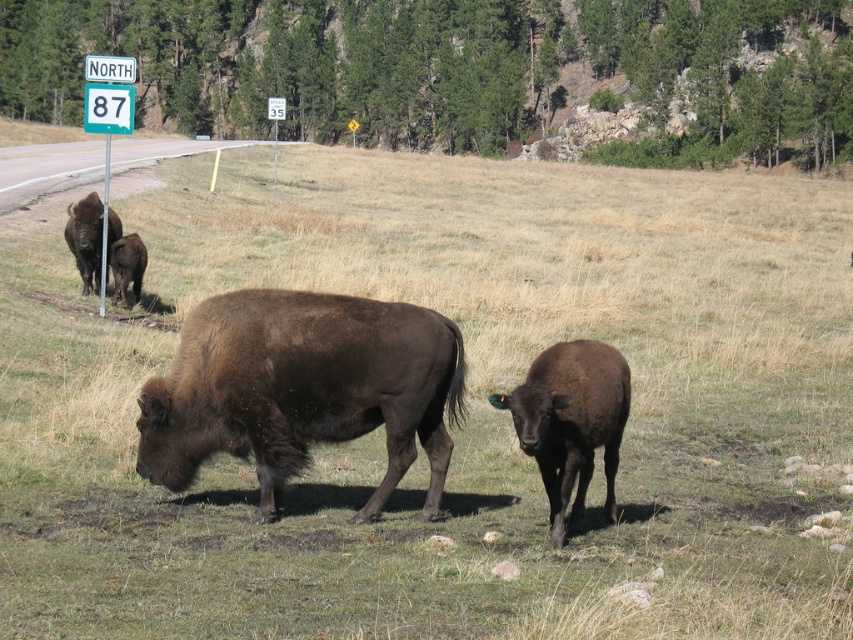
Question: Which point is farther to the camera?

Choices:
 (A) coord(30,172)
 (B) coord(132,266)
 (C) coord(106,198)
 (D) coord(622,141)

Answer: (D)

Question: Observing the image, what is the correct spatial positioning of brown furry buffalo at center in reference to brown matte buffalo at left?

Choices:
 (A) right
 (B) left

Answer: (A)

Question: Among these points, which one is nearest to the camera?

Choices:
 (A) (181, 408)
 (B) (113, 300)

Answer: (A)

Question: Is black glossy calf at center thinner than brushed metal sign at upper left?

Choices:
 (A) yes
 (B) no

Answer: (A)

Question: Is green plastic sign at upper left bigger than dark brown fur at left?

Choices:
 (A) no
 (B) yes

Answer: (B)

Question: Estimate the real-world distances between objects in this image. Which object is farther from the green plastic sign at upper left?

Choices:
 (A) green grass at upper center
 (B) brushed metal sign at upper left

Answer: (A)